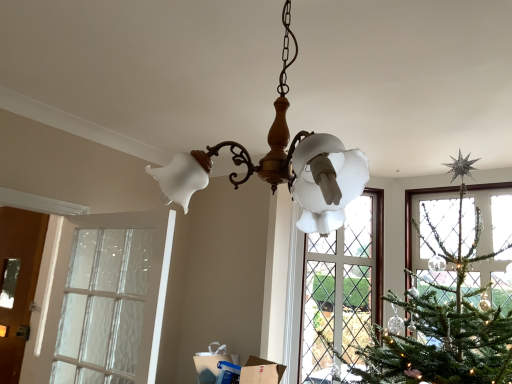
Identify the location of clear glass door at left. (103, 307).

What is the approximate width of matte white glass chandelier at center?

22.02 inches.

What do you see at coordinates (283, 163) in the screenshot? I see `matte white glass chandelier at center` at bounding box center [283, 163].

In order to click on clear glass door at left in this screenshot , I will do `click(103, 307)`.

Is matte white glass chandelier at center facing towards brown wooden door at left?

Yes, matte white glass chandelier at center is facing brown wooden door at left.

The width and height of the screenshot is (512, 384). What are the coordinates of `lamp lying in front of the brown wooden door at left` in the screenshot? It's located at (283, 163).

Does matte white glass chandelier at center contain brown wooden door at left?

No, brown wooden door at left is not a part of matte white glass chandelier at center.

Does matte white glass chandelier at center come in front of brown wooden door at left?

Yes, it is.

From the image's perspective, which one is positioned higher, clear glass door at left or brown wooden door at left?

clear glass door at left appears higher in the image.

How distant is clear glass door at left from brown wooden door at left?

clear glass door at left is 33.38 inches from brown wooden door at left.

Does point (106, 243) appear closer or farther from the camera than point (4, 257)?

Clearly, point (106, 243) is closer to the camera than point (4, 257).

From a real-world perspective, which object rests below the other?

brown wooden door at left, from a real-world perspective.

Considering the sizes of brown wooden door at left and clear glass door at left in the image, is brown wooden door at left bigger or smaller than clear glass door at left?

Clearly, brown wooden door at left is smaller in size than clear glass door at left.

Considering the relative positions of brown wooden door at left and clear glass door at left in the image provided, is brown wooden door at left to the left of clear glass door at left from the viewer's perspective?

Indeed, brown wooden door at left is positioned on the left side of clear glass door at left.

Locate an element on the screen. door behind the clear glass door at left is located at coordinates (18, 283).

From the image's perspective, between matte white glass chandelier at center and clear glass door at left, which one is located above?

matte white glass chandelier at center.

Is matte white glass chandelier at center shorter than clear glass door at left?

Yes.

From a real-world perspective, which object stands above the other?

matte white glass chandelier at center.

Is the depth of clear glass door at left less than that of matte white glass chandelier at center?

No, the depth of clear glass door at left is greater than that of matte white glass chandelier at center.

Is clear glass door at left positioned with its back to matte white glass chandelier at center?

No.

Considering the sizes of objects clear glass door at left and matte white glass chandelier at center in the image provided, who is smaller, clear glass door at left or matte white glass chandelier at center?

Smaller between the two is clear glass door at left.

Is clear glass door at left positioned beyond the bounds of matte white glass chandelier at center?

Yes, clear glass door at left is outside of matte white glass chandelier at center.

Consider the image. Is brown wooden door at left positioned before matte white glass chandelier at center?

No, the depth of brown wooden door at left is greater than that of matte white glass chandelier at center.

Does brown wooden door at left touch matte white glass chandelier at center?

No.

Is brown wooden door at left wider than matte white glass chandelier at center?

In fact, brown wooden door at left might be narrower than matte white glass chandelier at center.

Considering the points (10, 364) and (359, 174), which point is in front, point (10, 364) or point (359, 174)?

The point (359, 174) is in front.

The width and height of the screenshot is (512, 384). In order to click on lamp on the right of the brown wooden door at left in this screenshot , I will do `click(283, 163)`.

Where is `window lying in front of the brown wooden door at left`? This screenshot has width=512, height=384. window lying in front of the brown wooden door at left is located at coordinates (103, 307).

Estimate the real-world distances between objects in this image. Which object is closer to clear glass door at left, brown wooden door at left or matte white glass chandelier at center?

Among the two, brown wooden door at left is located nearer to clear glass door at left.

Looking at the image, which one is located further to clear glass door at left, matte white glass chandelier at center or brown wooden door at left?

matte white glass chandelier at center is further to clear glass door at left.

From the image, which object appears to be farther from matte white glass chandelier at center, clear glass door at left or brown wooden door at left?

brown wooden door at left.

When comparing their distances from matte white glass chandelier at center, does brown wooden door at left or clear glass door at left seem further?

The object further to matte white glass chandelier at center is brown wooden door at left.

When comparing their distances from brown wooden door at left, does matte white glass chandelier at center or clear glass door at left seem closer?

Among the two, clear glass door at left is located nearer to brown wooden door at left.

Considering their positions, is clear glass door at left positioned closer to brown wooden door at left than matte white glass chandelier at center?

Among the two, clear glass door at left is located nearer to brown wooden door at left.

Locate an element on the screen. This screenshot has width=512, height=384. window located between matte white glass chandelier at center and brown wooden door at left in the depth direction is located at coordinates click(x=103, y=307).